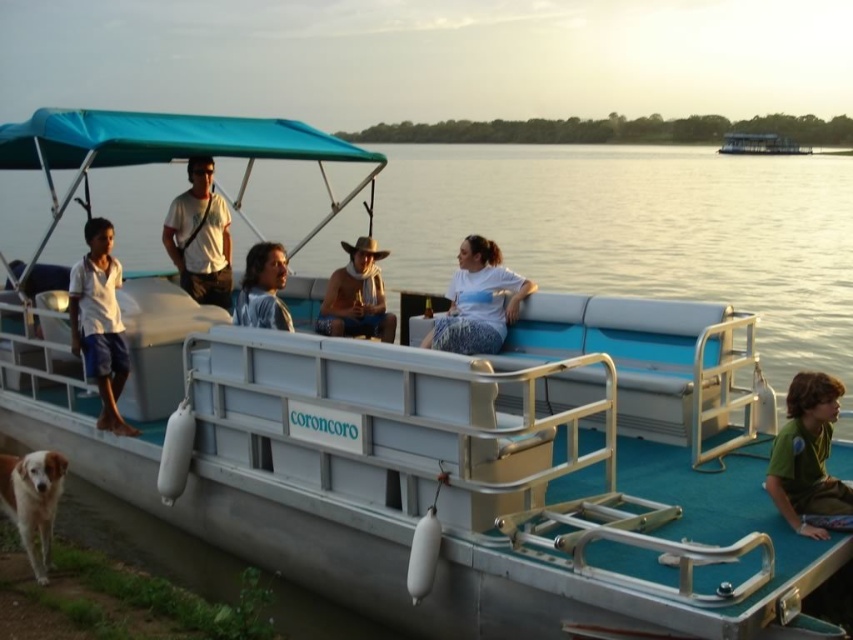
Question: Is white matte shirt at left below white cotton shirt at upper center?

Choices:
 (A) yes
 (B) no

Answer: (A)

Question: Is white matte shirt at left thinner than white matte shirt at center?

Choices:
 (A) no
 (B) yes

Answer: (B)

Question: Which object is positioned farthest from the white cotton shirt at upper center?

Choices:
 (A) white matte shirt at left
 (B) white matte shirt at center

Answer: (B)

Question: Considering the relative positions of white cotton shirt at upper center and matte black shirt at center in the image provided, where is white cotton shirt at upper center located with respect to matte black shirt at center?

Choices:
 (A) left
 (B) right

Answer: (A)

Question: Which point is farther to the camera?

Choices:
 (A) blue plastic boat at center
 (B) white cotton shirt at upper center
 (C) white matte shirt at center
 (D) shiny metallic cowboy hat at center

Answer: (A)

Question: Which point is farther to the camera?

Choices:
 (A) green fabric shirt at lower right
 (B) golden fur dog at lower left
 (C) shiny metallic cowboy hat at center
 (D) white matte shirt at center

Answer: (C)